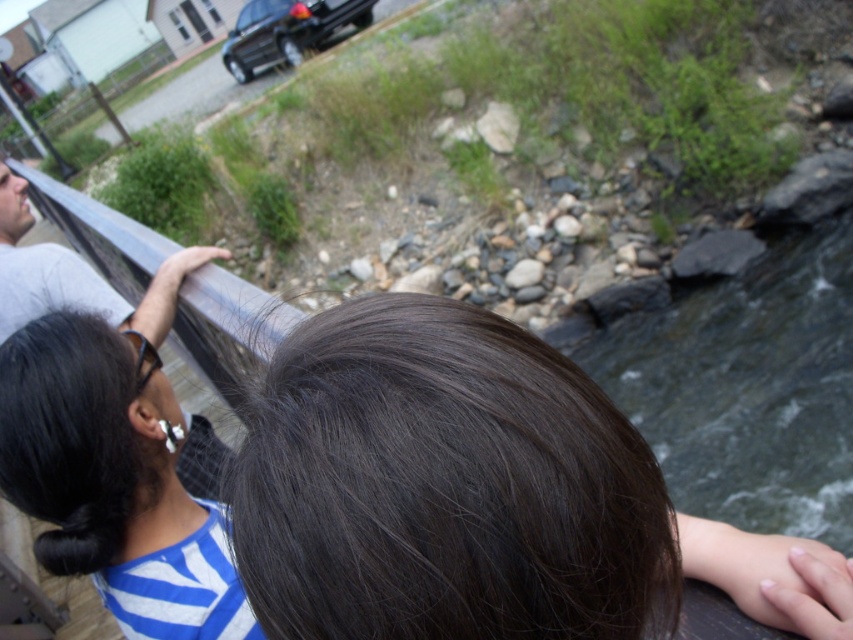
You are trying to identify two people on the bridge based on their clothing and hair. The dark brown hair at center and the gray fabric shirt at left are both visible. Which of these two has a narrower width?

The dark brown hair at center has a narrower width than the gray fabric shirt at left according to the description.

You are standing on the bridge and want to know which object is lower between the black matte hair at upper left and the gray fabric shirt at left. Which one is lower?

The black matte hair at upper left is lower than the gray fabric shirt at left because it has a lesser height compared to the gray fabric shirt at left.

You are a photographer trying to capture the black matte hair at upper left in the scene. Based on its position, which corner of the image should you focus on to ensure it is centered in your shot?

The black matte hair at upper left is positioned at point 0.750 on the x axis and 0.135 on the y axis. To center it, focus on the upper left corner of the image since the coordinates are closer to the left and top edges.